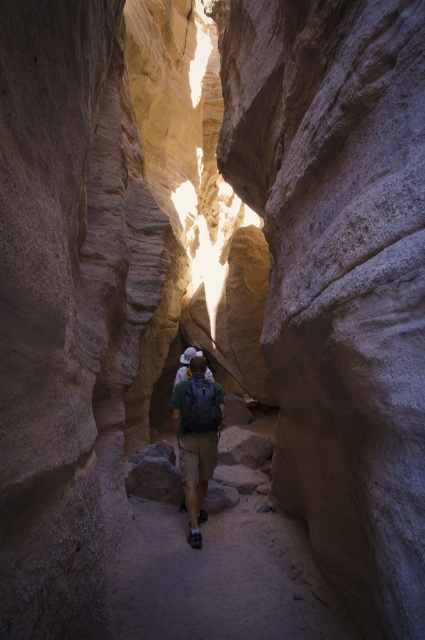
Is brown dirt path at center thinner than green fabric backpack at center?

Incorrect, brown dirt path at center's width is not less than green fabric backpack at center's.

Which of these two, brown dirt path at center or green fabric backpack at center, stands taller?

green fabric backpack at center

Does point (212, 620) come in front of point (197, 460)?

Yes, it is.

Locate an element on the screen. The height and width of the screenshot is (640, 425). brown dirt path at center is located at coordinates (221, 577).